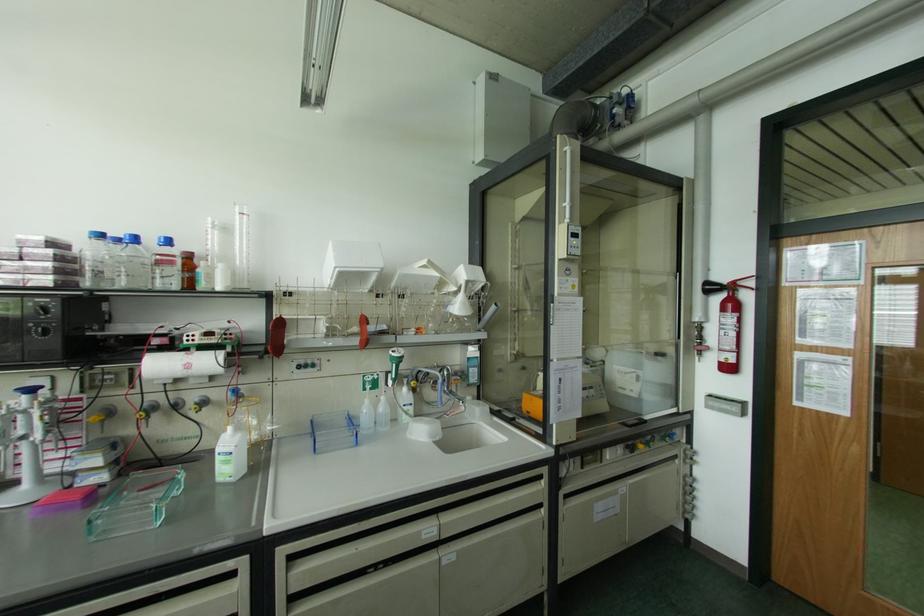
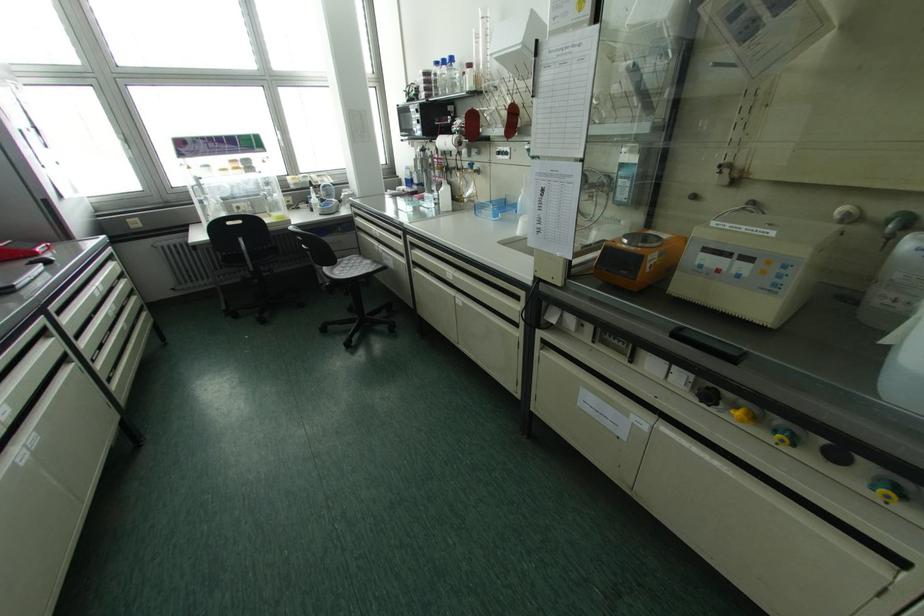
Find the pixel in the second image that matches point 299,367 in the first image.

(497, 153)